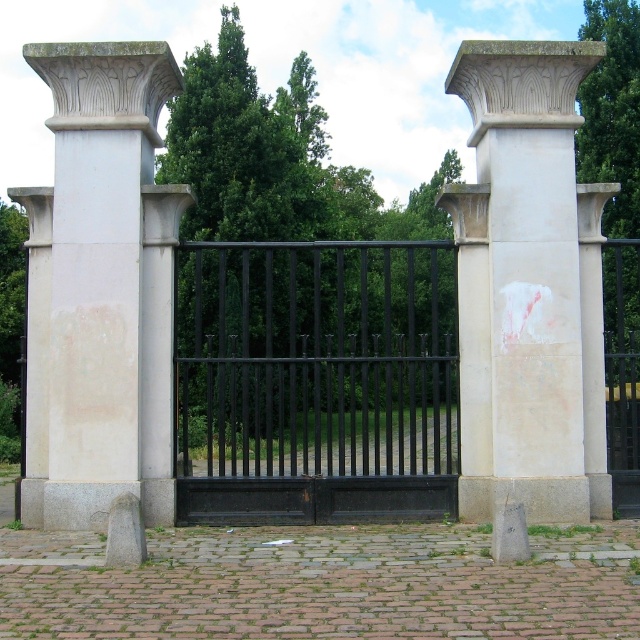
Question: Which point is closer to the camera taking this photo?

Choices:
 (A) (314, 397)
 (B) (172, 205)

Answer: (B)

Question: Observing the image, what is the correct spatial positioning of white stone column at center in reference to white stone column at left?

Choices:
 (A) below
 (B) above

Answer: (B)

Question: Is black metal fence at center below white stone column at center?

Choices:
 (A) no
 (B) yes

Answer: (B)

Question: Which point is closer to the camera taking this photo?

Choices:
 (A) (486, 86)
 (B) (621, 291)

Answer: (A)

Question: Which point is farther from the camera taking this photo?

Choices:
 (A) (464, 481)
 (B) (33, 49)

Answer: (A)

Question: Is white stone column at center thinner than white stone column at left?

Choices:
 (A) no
 (B) yes

Answer: (B)